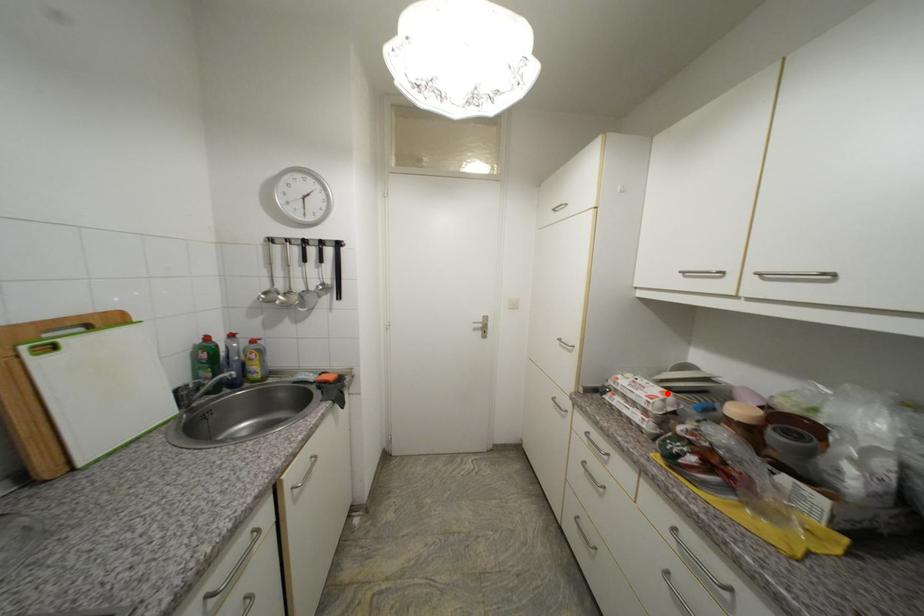
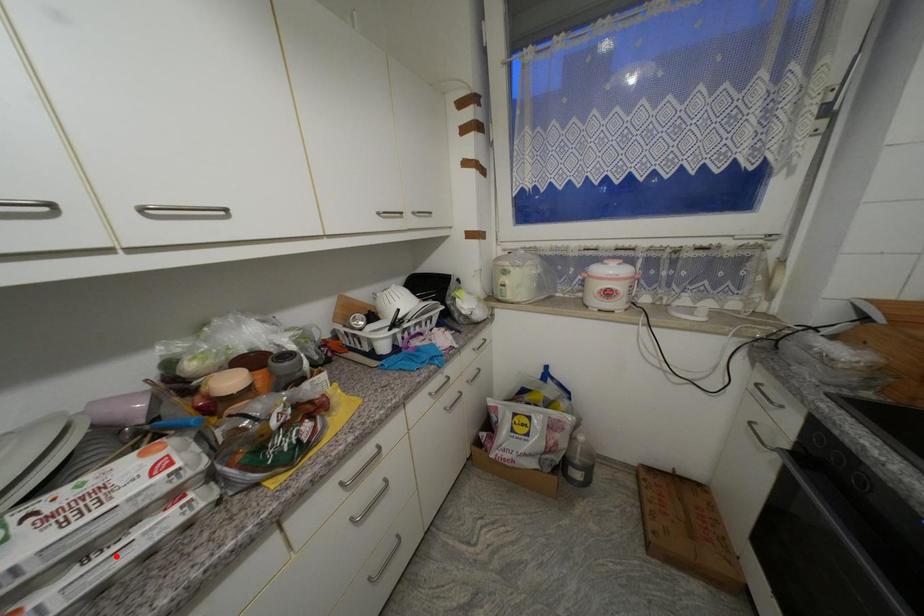
I am providing you with two images of the same scene from different viewpoints. A red point is marked on the first image and another point is marked on the second image. Are the points marked in image1 and image2 representing the same 3D position?

No